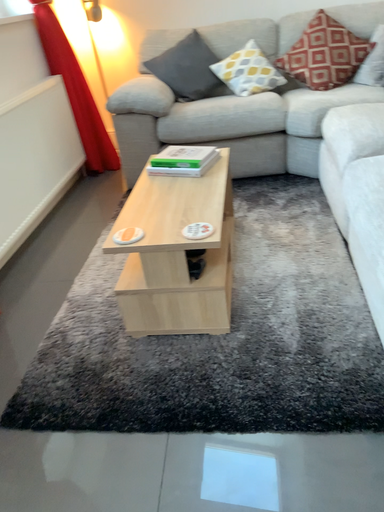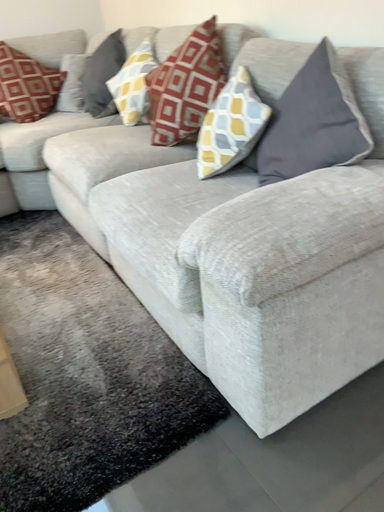
Question: Which way did the camera rotate in the video?

Choices:
 (A) rotated right
 (B) rotated left

Answer: (A)